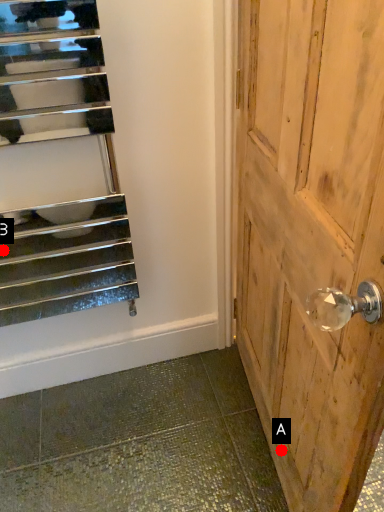
Question: Two points are circled on the image, labeled by A and B beside each circle. Among these points, which one is farthest from the camera?

Choices:
 (A) A is further
 (B) B is further

Answer: (B)